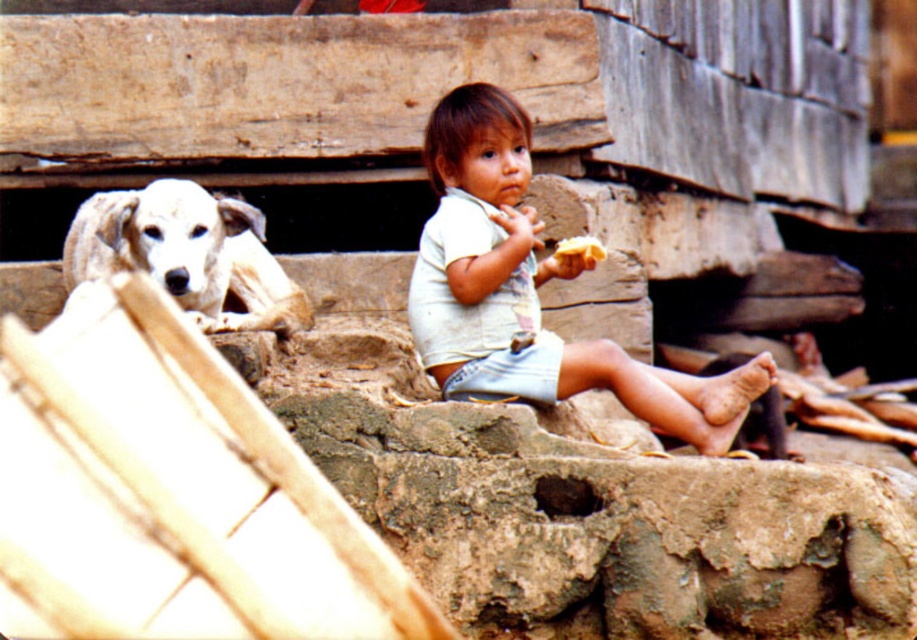
Question: Which point appears farthest from the camera in this image?

Choices:
 (A) (562, 252)
 (B) (525, 280)

Answer: (A)

Question: Estimate the real-world distances between objects in this image. Which object is farther from the yellow crumbly bread at center?

Choices:
 (A) light beige cotton shirt at center
 (B) white fur dog at left

Answer: (B)

Question: Does light beige cotton shirt at center appear on the left side of white fur dog at left?

Choices:
 (A) yes
 (B) no

Answer: (B)

Question: Among these objects, which one is nearest to the camera?

Choices:
 (A) yellow crumbly bread at center
 (B) light beige cotton shirt at center
 (C) white fur dog at left

Answer: (C)

Question: Does light beige cotton shirt at center appear on the right side of yellow crumbly bread at center?

Choices:
 (A) no
 (B) yes

Answer: (A)

Question: Is light beige cotton shirt at center closer to camera compared to white fur dog at left?

Choices:
 (A) yes
 (B) no

Answer: (B)